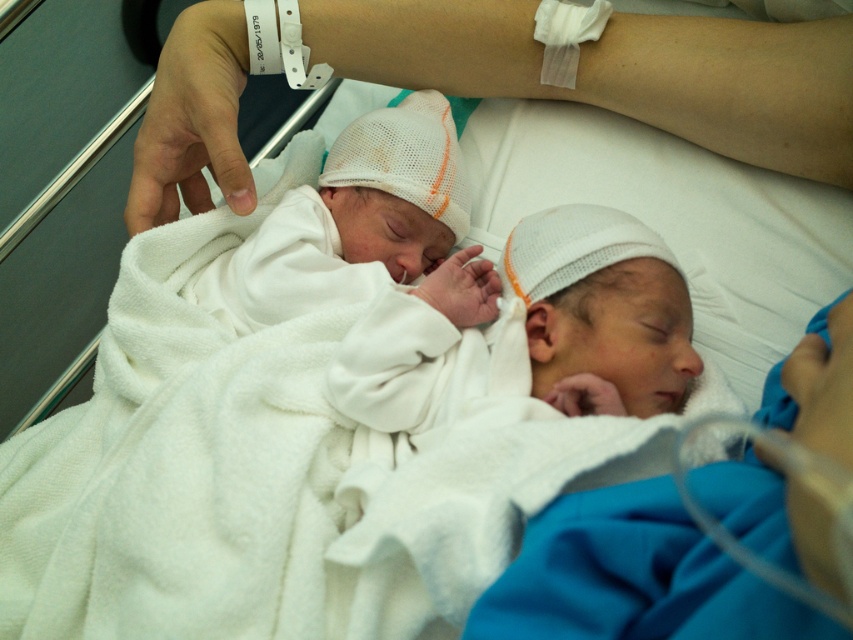
Question: Does white soft blanket at center lie in front of white mesh hat at center?

Choices:
 (A) no
 (B) yes

Answer: (B)

Question: Which object is farther from the camera taking this photo?

Choices:
 (A) white knit cap at center
 (B) white soft blanket at center
 (C) white mesh hat at center

Answer: (C)

Question: Based on their relative distances, which object is nearer to the white mesh hat at center?

Choices:
 (A) white soft blanket at center
 (B) white knit cap at center

Answer: (B)

Question: Can you confirm if white soft blanket at center is positioned to the right of white mesh hat at center?

Choices:
 (A) yes
 (B) no

Answer: (A)

Question: Can you confirm if white knit cap at center is positioned to the left of white soft blanket at center?

Choices:
 (A) no
 (B) yes

Answer: (B)

Question: Considering the real-world distances, which object is farthest from the white mesh hat at center?

Choices:
 (A) white knit cap at center
 (B) white soft blanket at center

Answer: (B)